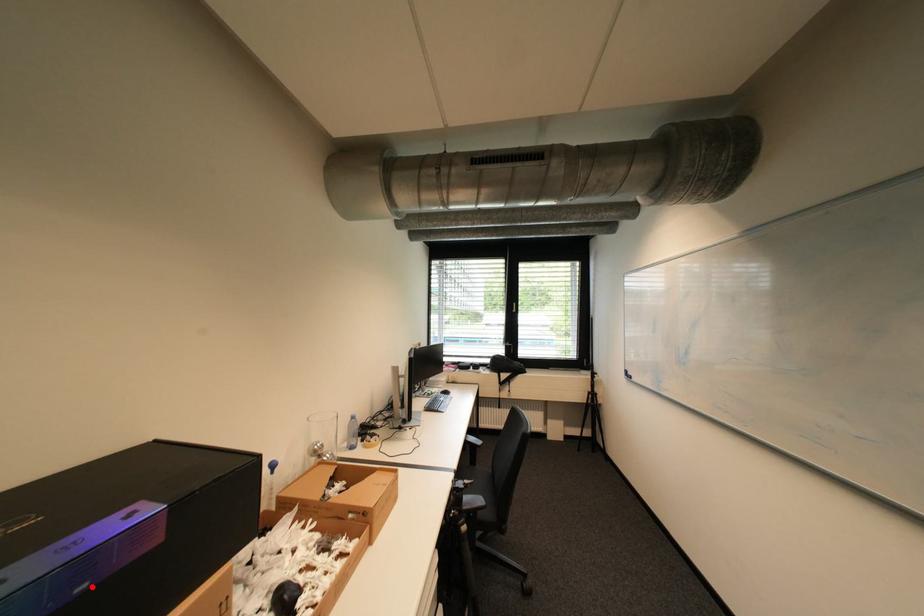
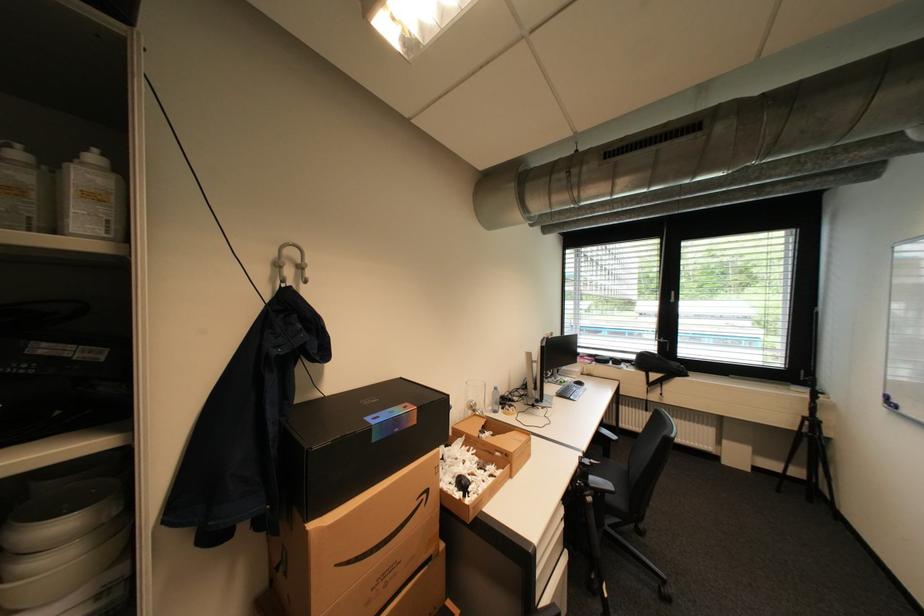
Locate, in the second image, the point that corresponds to the highlighted location in the first image.

(405, 431)